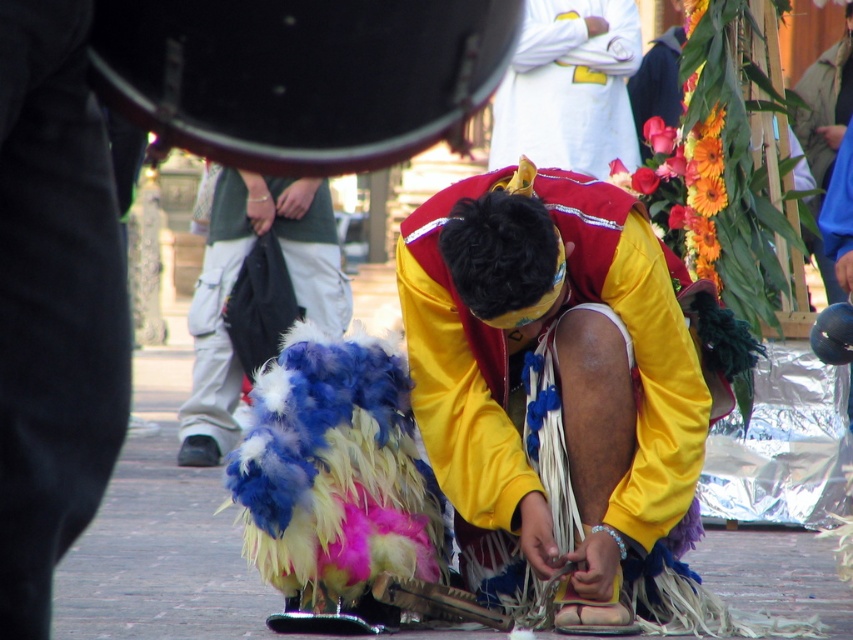
Is feathered costume at center taller than white cotton shirt at upper center?

Yes, feathered costume at center is taller than white cotton shirt at upper center.

Is feathered costume at center further to camera compared to white cotton shirt at upper center?

Yes, it is.

Is point (193, 458) positioned before point (613, 74)?

Yes, it is.

Where is `feathered costume at center`? The width and height of the screenshot is (853, 640). feathered costume at center is located at coordinates (234, 282).

Who is more forward, (577, 465) or (614, 58)?

Point (577, 465) is in front.

Looking at this image, is yellow fabric at center positioned behind white cotton shirt at upper center?

Yes, yellow fabric at center is further from the viewer.

Which is behind, point (480, 376) or point (514, 76)?

The point (514, 76) is behind.

I want to click on yellow fabric at center, so click(x=553, y=372).

Can you confirm if yellow fabric at center is positioned to the left of feathered costume at center?

In fact, yellow fabric at center is to the right of feathered costume at center.

Is yellow fabric at center behind feathered costume at center?

Yes, yellow fabric at center is further from the viewer.

Identify the location of yellow fabric at center. (553, 372).

You are a GUI agent. You are given a task and a screenshot of the screen. Output one action in this format:
    pyautogui.click(x=<x>, y=<y>)
    Task: Click on the yellow fabric at center
    The height and width of the screenshot is (640, 853).
    Given the screenshot: What is the action you would take?
    pyautogui.click(x=553, y=372)